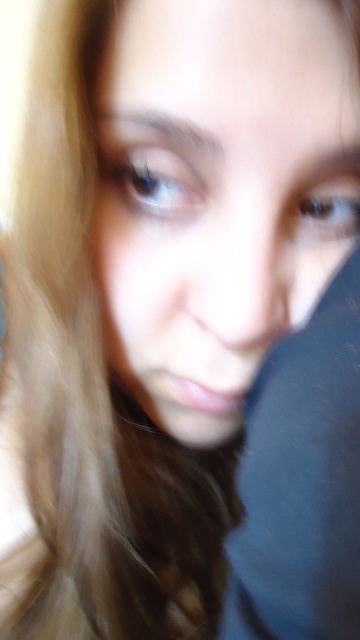
You are a photographer trying to capture a portrait. You notice the blue glossy eye at upper left and the blue glossy eye at upper right in the frame. Which eye appears taller in the image?

The blue glossy eye at upper left is taller than the blue glossy eye at upper right.

You are a photographer analyzing the portrait. You notice the blue glossy eye at upper left and the blue glossy eye at upper right. Which eye is located higher in the frame?

The blue glossy eye at upper left is positioned over the blue glossy eye at upper right, meaning it is higher in the frame.

Based on the coordinates provided, where is the smooth skin face at center located in the image?

The smooth skin face at center is located at the 2D coordinates point (214, 193).